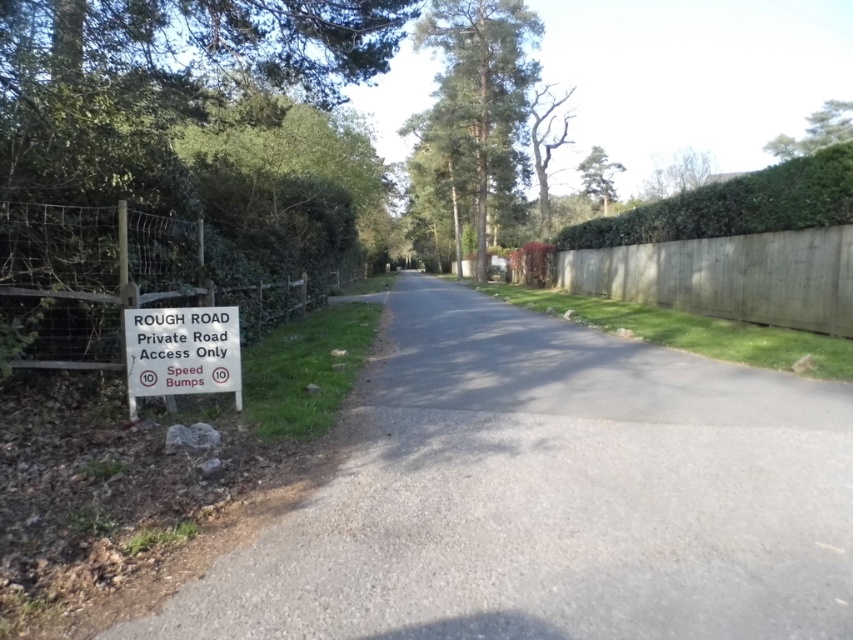
Question: Considering the relative positions of wooden fence at left and smooth wooden fence at right in the image provided, where is wooden fence at left located with respect to smooth wooden fence at right?

Choices:
 (A) above
 (B) below

Answer: (B)

Question: Is gray asphalt road at left further to camera compared to wooden fence at left?

Choices:
 (A) no
 (B) yes

Answer: (A)

Question: Estimate the real-world distances between objects in this image. Which object is farther from the gray asphalt road at left?

Choices:
 (A) wooden fence at left
 (B) white plastic sign at left
 (C) smooth wooden fence at right
 (D) green leafy hedge at upper right

Answer: (D)

Question: Which object is closer to the camera taking this photo?

Choices:
 (A) white plastic sign at left
 (B) gray asphalt road at left
 (C) smooth wooden fence at right

Answer: (B)

Question: Which point is farther to the camera?

Choices:
 (A) (177, 259)
 (B) (154, 381)
 (C) (567, 636)

Answer: (A)

Question: Can you confirm if gray asphalt road at left is positioned below smooth wooden fence at right?

Choices:
 (A) yes
 (B) no

Answer: (A)